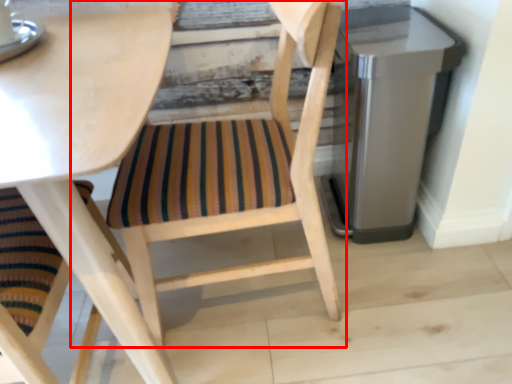
Question: From the image's perspective, what is the correct spatial positioning of chair (annotated by the red box) in reference to appliance?

Choices:
 (A) below
 (B) above

Answer: (A)